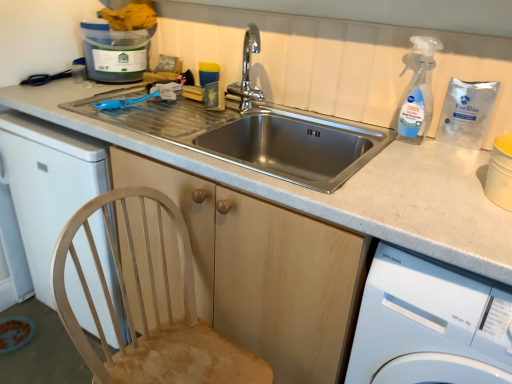
The image size is (512, 384). In order to click on free space to the left of transparent plastic spray bottle at upper right in this screenshot , I will do `click(358, 131)`.